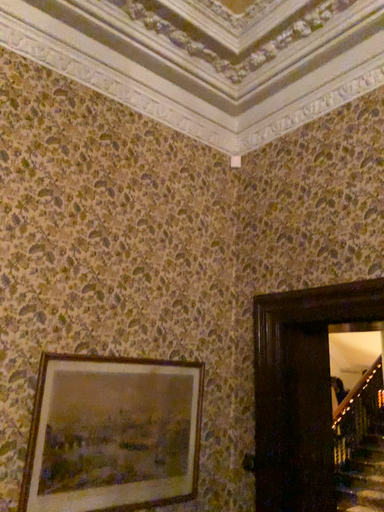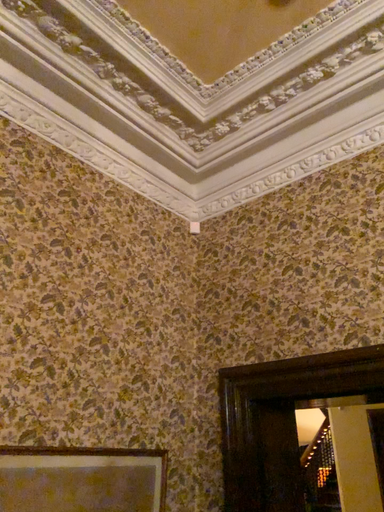
Question: How did the camera likely rotate when shooting the video?

Choices:
 (A) rotated downward
 (B) rotated upward

Answer: (B)